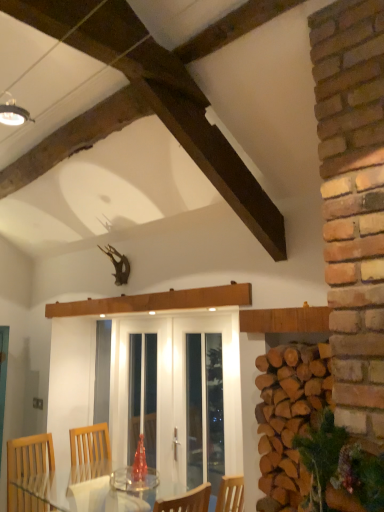
Question: Is white glass screen door at center, the 2th screen door viewed from the right, shorter than white glass door at center, the first screen door viewed from the right?

Choices:
 (A) no
 (B) yes

Answer: (A)

Question: From the image's perspective, is white glass screen door at center, the 2th screen door viewed from the right, located above white glass door at center, the second screen door in the left-to-right sequence?

Choices:
 (A) no
 (B) yes

Answer: (A)

Question: From a real-world perspective, is white glass screen door at center, the 2th screen door viewed from the right, positioned under white glass door at center, the second screen door in the left-to-right sequence, based on gravity?

Choices:
 (A) yes
 (B) no

Answer: (A)

Question: Is white glass door at center, the first screen door viewed from the right, completely or partially inside white glass screen door at center, the 2th screen door viewed from the right?

Choices:
 (A) no
 (B) yes

Answer: (B)

Question: Does white glass screen door at center, the 1th screen door positioned from the left, come in front of white glass door at center, the second screen door in the left-to-right sequence?

Choices:
 (A) yes
 (B) no

Answer: (A)

Question: Does white glass screen door at center, the 2th screen door viewed from the right, have a lesser width compared to white glass door at center, the first screen door viewed from the right?

Choices:
 (A) yes
 (B) no

Answer: (B)

Question: From the image's perspective, does natural brown woodpile at right appear higher than white glass screen door at center, the 2th screen door viewed from the right?

Choices:
 (A) no
 (B) yes

Answer: (B)

Question: Is natural brown woodpile at right bigger than white glass screen door at center, the 2th screen door viewed from the right?

Choices:
 (A) yes
 (B) no

Answer: (B)

Question: Is natural brown woodpile at right positioned beyond the bounds of white glass screen door at center, the 1th screen door positioned from the left?

Choices:
 (A) no
 (B) yes

Answer: (B)

Question: Can you confirm if natural brown woodpile at right is wider than white glass screen door at center, the 2th screen door viewed from the right?

Choices:
 (A) yes
 (B) no

Answer: (A)

Question: Can you see natural brown woodpile at right touching white glass screen door at center, the 2th screen door viewed from the right?

Choices:
 (A) yes
 (B) no

Answer: (B)

Question: Could you tell me if natural brown woodpile at right is facing white glass screen door at center, the 1th screen door positioned from the left?

Choices:
 (A) no
 (B) yes

Answer: (A)

Question: From the image's perspective, would you say white glass door at center, the second screen door in the left-to-right sequence, is shown under natural brown woodpile at right?

Choices:
 (A) no
 (B) yes

Answer: (B)